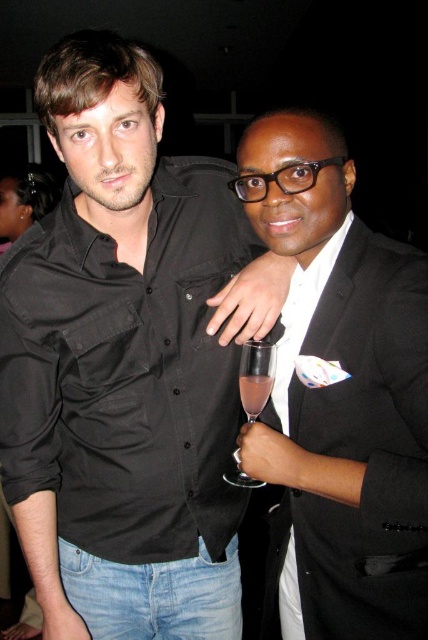
In the scene shown: You are at a party and want to take a photo of the black satin suit at right without the black matte shirt at center blocking it. What should you do?

The black satin suit at right is behind the black matte shirt at center, so you should move to a position where the black satin suit at right is in front of the black matte shirt at center or move the black matte shirt at center out of the way to capture the black satin suit at right without obstruction.

You are a photographer at a social event. You need to capture a photo where the black satin suit at right and the pink translucent liquid at center are both clearly visible. Based on their positions, which object should you focus on first to ensure both are in sharp focus?

The black satin suit at right is located below the pink translucent liquid at center. To ensure both are in sharp focus, you should focus on the pink translucent liquid at center first since it is farther away from the camera, allowing the black satin suit at right to also be in focus within the depth of field.